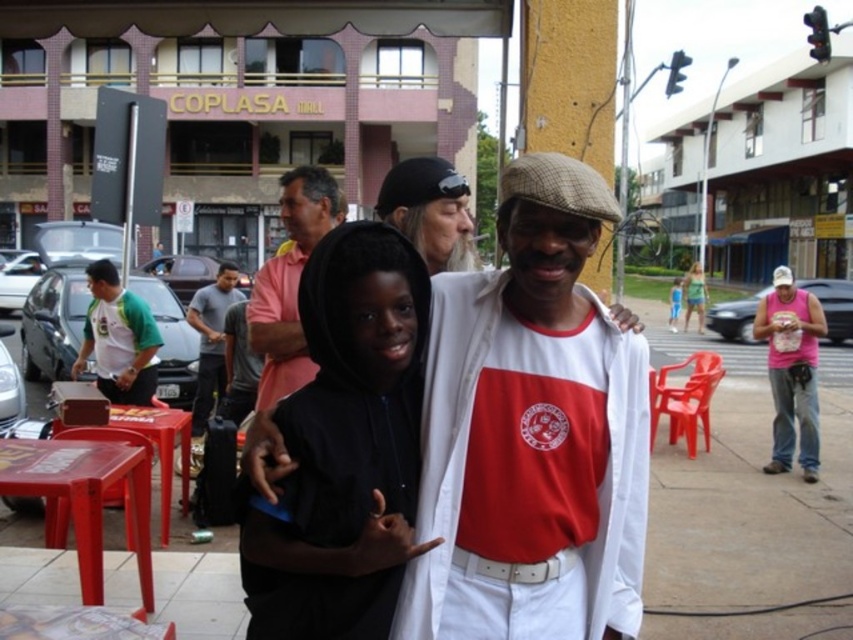
Question: Does pink cotton shirt at center have a larger size compared to gray cotton shirt at center?

Choices:
 (A) yes
 (B) no

Answer: (A)

Question: Which point is farther to the camera?

Choices:
 (A) (672, 330)
 (B) (102, 564)
 (C) (697, 273)

Answer: (C)

Question: Which is nearer to the white concrete pavement at center?

Choices:
 (A) black hoodie at center
 (B) matte white jacket at center
 (C) green and white jersey at left

Answer: (C)

Question: Is white concrete pavement at center positioned behind matte plastic stool at lower left?

Choices:
 (A) no
 (B) yes

Answer: (B)

Question: Which is farther from the gray cotton shirt at center?

Choices:
 (A) blue fabric shorts at lower right
 (B) pink cotton shirt at center
 (C) wooden stool at lower left
 (D) green fabric shorts at lower right

Answer: (D)

Question: Does black hoodie at center come behind gray cotton shirt at center?

Choices:
 (A) no
 (B) yes

Answer: (A)